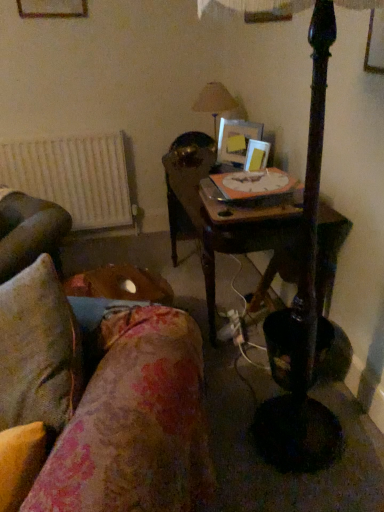
Measure the distance between wooden picture frame at center, which is counted as the 2th picture frame, starting from the top, and camera.

wooden picture frame at center, which is counted as the 2th picture frame, starting from the top, is 6.89 feet from camera.

You are a GUI agent. You are given a task and a screenshot of the screen. Output one action in this format:
    pyautogui.click(x=<x>, y=<y>)
    Task: Click on the white matte radiator at left
    The height and width of the screenshot is (512, 384).
    Given the screenshot: What is the action you would take?
    pyautogui.click(x=73, y=177)

This screenshot has width=384, height=512. What do you see at coordinates (106, 402) in the screenshot?
I see `floral fabric couch at lower left` at bounding box center [106, 402].

The height and width of the screenshot is (512, 384). I want to click on matte wooden picture frame at upper center, acting as the first picture frame starting from the bottom, so click(256, 155).

Is white matte radiator at left behind matte beige lampshade at upper center?

Yes, the depth of white matte radiator at left is greater than that of matte beige lampshade at upper center.

Is point (123, 179) closer to camera compared to point (214, 92)?

No, (123, 179) is behind (214, 92).

Is white matte radiator at left far from matte beige lampshade at upper center?

No, white matte radiator at left is not far from matte beige lampshade at upper center.

This screenshot has width=384, height=512. I want to click on picture frame located on the left of wooden picture frame at center, the 2th picture frame positioned from the left, so click(x=52, y=8).

Considering the sizes of objects wooden picture frame at center, the 2th picture frame positioned from the right, and wooden picture frame at upper left, positioned as the 1th picture frame in top-to-bottom order, in the image provided, who is taller, wooden picture frame at center, the 2th picture frame positioned from the right, or wooden picture frame at upper left, positioned as the 1th picture frame in top-to-bottom order,?

Standing taller between the two is wooden picture frame at upper left, positioned as the 1th picture frame in top-to-bottom order.

Is point (246, 150) closer or farther from the camera than point (64, 4)?

Point (246, 150) is closer to the camera than point (64, 4).

From a real-world perspective, between wooden picture frame at center, which is counted as the 2th picture frame, starting from the top, and wooden picture frame at upper left, placed as the third picture frame when sorted from right to left, who is vertically higher?

From a 3D spatial view, wooden picture frame at upper left, placed as the third picture frame when sorted from right to left, is above.

Does floral fabric couch at lower left have a smaller size compared to wooden picture frame at upper left, which appears as the 1th picture frame when viewed from the left?

Actually, floral fabric couch at lower left might be larger than wooden picture frame at upper left, which appears as the 1th picture frame when viewed from the left.

Is floral fabric couch at lower left aimed at wooden picture frame at upper left, which appears as the 1th picture frame when viewed from the left?

No.

Considering the sizes of objects floral fabric couch at lower left and wooden picture frame at upper left, positioned as the 1th picture frame in top-to-bottom order, in the image provided, who is wider, floral fabric couch at lower left or wooden picture frame at upper left, positioned as the 1th picture frame in top-to-bottom order,?

floral fabric couch at lower left.

Is floral fabric couch at lower left next to wooden picture frame at upper left, positioned as the 1th picture frame in top-to-bottom order?

floral fabric couch at lower left and wooden picture frame at upper left, positioned as the 1th picture frame in top-to-bottom order, are clearly separated.

Considering their positions, is matte beige lampshade at upper center located in front of or behind matte wooden picture frame at upper center, arranged as the 1th picture frame when viewed from the right?

Clearly, matte beige lampshade at upper center is behind matte wooden picture frame at upper center, arranged as the 1th picture frame when viewed from the right.

In terms of width, does matte beige lampshade at upper center look wider or thinner when compared to matte wooden picture frame at upper center, acting as the first picture frame starting from the bottom?

In the image, matte beige lampshade at upper center appears to be wider than matte wooden picture frame at upper center, acting as the first picture frame starting from the bottom.

Is matte beige lampshade at upper center oriented towards matte wooden picture frame at upper center, acting as the first picture frame starting from the bottom?

No, matte beige lampshade at upper center is not facing towards matte wooden picture frame at upper center, acting as the first picture frame starting from the bottom.

In the scene shown: What's the angular difference between matte beige lampshade at upper center and matte wooden picture frame at upper center, arranged as the 1th picture frame when viewed from the right,'s facing directions?

They differ by 24.4 degrees in their facing directions.

Measure the distance from wooden table at center to matte beige lampshade at upper center.

wooden table at center and matte beige lampshade at upper center are 29.32 inches apart from each other.

Which is less distant, (202, 204) or (217, 114)?

Point (202, 204) is closer to the camera than point (217, 114).

Is matte beige lampshade at upper center inside wooden table at center?

Actually, matte beige lampshade at upper center is outside wooden table at center.

From the image's perspective, between wooden table at center and matte beige lampshade at upper center, who is located below?

wooden table at center is shown below in the image.

Consider the image. Can you confirm if wooden picture frame at upper left, positioned as the 1th picture frame in top-to-bottom order, is taller than wooden picture frame at center, the 2th picture frame positioned from the right?

Yes, wooden picture frame at upper left, positioned as the 1th picture frame in top-to-bottom order, is taller than wooden picture frame at center, the 2th picture frame positioned from the right.

Is point (79, 3) positioned after point (239, 149)?

Yes.

Measure the distance between wooden picture frame at upper left, placed as the third picture frame when sorted from right to left, and wooden picture frame at center, which is counted as the 2th picture frame, starting from the top.

The distance of wooden picture frame at upper left, placed as the third picture frame when sorted from right to left, from wooden picture frame at center, which is counted as the 2th picture frame, starting from the top, is 1.29 meters.

Is wooden picture frame at upper left, which appears as the 1th picture frame when viewed from the left, wider or thinner than wooden picture frame at center, the 2th picture frame positioned from the left?

Considering their sizes, wooden picture frame at upper left, which appears as the 1th picture frame when viewed from the left, looks slimmer than wooden picture frame at center, the 2th picture frame positioned from the left.

From the image's perspective, is matte beige lampshade at upper center above or below white matte radiator at left?

Clearly, from the image's perspective, matte beige lampshade at upper center is above white matte radiator at left.

Could you tell me if matte beige lampshade at upper center is facing white matte radiator at left?

Yes, matte beige lampshade at upper center is turned towards white matte radiator at left.

Looking at this image, does matte beige lampshade at upper center lie in front of white matte radiator at left?

Yes, it is.

Measure the distance from matte beige lampshade at upper center to white matte radiator at left.

A distance of 37.10 inches exists between matte beige lampshade at upper center and white matte radiator at left.

This screenshot has width=384, height=512. Find the location of `radiator below the matte beige lampshade at upper center (from a real-world perspective)`. radiator below the matte beige lampshade at upper center (from a real-world perspective) is located at coordinates (73, 177).

This screenshot has height=512, width=384. In order to click on picture frame that is the 1st object located below the wooden picture frame at upper left, which appears as the 1th picture frame when viewed from the left (from the image's perspective) in this screenshot , I will do [236, 140].

Considering their positions, is wooden picture frame at upper left, the 3th picture frame ordered from the bottom, positioned closer to floral fabric couch at lower left than matte beige lampshade at upper center?

matte beige lampshade at upper center is closer to floral fabric couch at lower left.

Which object lies nearer to the anchor point matte wooden picture frame at upper center, acting as the first picture frame starting from the bottom, floral fabric couch at lower left or wooden picture frame at center, the 2th picture frame positioned from the right?

wooden picture frame at center, the 2th picture frame positioned from the right, is closer to matte wooden picture frame at upper center, acting as the first picture frame starting from the bottom.

In the scene shown: Considering their positions, is wooden picture frame at upper left, the 3th picture frame ordered from the bottom, positioned further to wooden table at center than wooden picture frame at center, the 2th picture frame positioned from the left?

wooden picture frame at upper left, the 3th picture frame ordered from the bottom, is further to wooden table at center.

Estimate the real-world distances between objects in this image. Which object is closer to matte beige lampshade at upper center, matte wooden picture frame at upper center, acting as the third picture frame starting from the left, or wooden picture frame at upper left, positioned as the 1th picture frame in top-to-bottom order?

matte wooden picture frame at upper center, acting as the third picture frame starting from the left, is closer to matte beige lampshade at upper center.

From the image, which object appears to be nearer to floral fabric couch at lower left, matte wooden picture frame at upper center, acting as the third picture frame starting from the left, or wooden table at center?

wooden table at center is positioned closer to the anchor floral fabric couch at lower left.

Which object lies nearer to the anchor point wooden picture frame at center, the 2th picture frame positioned from the left, wooden table at center or wooden picture frame at upper left, the 3th picture frame ordered from the bottom?

wooden table at center.

Based on their spatial positions, is wooden table at center or wooden picture frame at upper left, which appears as the 1th picture frame when viewed from the left, further from matte wooden picture frame at upper center, acting as the third picture frame starting from the left?

Based on the image, wooden picture frame at upper left, which appears as the 1th picture frame when viewed from the left, appears to be further to matte wooden picture frame at upper center, acting as the third picture frame starting from the left.

When comparing their distances from matte wooden picture frame at upper center, acting as the third picture frame starting from the left, does wooden picture frame at upper left, placed as the third picture frame when sorted from right to left, or floral fabric couch at lower left seem closer?

floral fabric couch at lower left is closer to matte wooden picture frame at upper center, acting as the third picture frame starting from the left.

Where is `table between floral fabric couch at lower left and matte beige lampshade at upper center along the z-axis`? The height and width of the screenshot is (512, 384). table between floral fabric couch at lower left and matte beige lampshade at upper center along the z-axis is located at coordinates click(223, 218).

Find the location of `picture frame located between wooden picture frame at upper left, which appears as the 1th picture frame when viewed from the left, and matte wooden picture frame at upper center, acting as the first picture frame starting from the bottom, in the left-right direction`. picture frame located between wooden picture frame at upper left, which appears as the 1th picture frame when viewed from the left, and matte wooden picture frame at upper center, acting as the first picture frame starting from the bottom, in the left-right direction is located at coordinates (236, 140).

Find the location of a particular element. This screenshot has width=384, height=512. picture frame between white matte radiator at left and wooden picture frame at center, positioned as the 2th picture frame in bottom-to-top order, from left to right is located at coordinates (52, 8).

Find the location of a particular element. The width and height of the screenshot is (384, 512). table lamp located between wooden picture frame at upper left, the 3th picture frame ordered from the bottom, and matte wooden picture frame at upper center, marked as the 3th picture frame in a top-to-bottom arrangement, in the left-right direction is located at coordinates (214, 102).